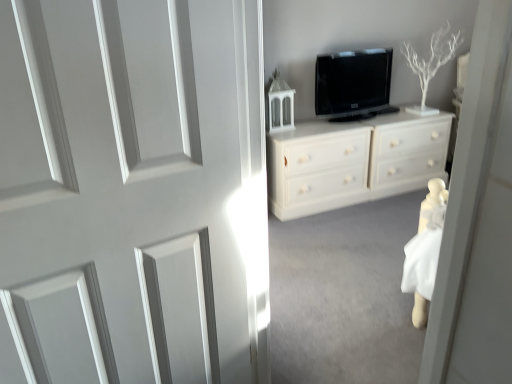
Question: Is white painted wood chest of drawers at center shorter than black glossy tv at upper center?

Choices:
 (A) no
 (B) yes

Answer: (A)

Question: Does white painted wood chest of drawers at center have a greater width compared to black glossy tv at upper center?

Choices:
 (A) yes
 (B) no

Answer: (A)

Question: Considering the relative positions of white painted wood chest of drawers at center and black glossy tv at upper center in the image provided, is white painted wood chest of drawers at center to the left of black glossy tv at upper center from the viewer's perspective?

Choices:
 (A) no
 (B) yes

Answer: (A)

Question: Is white painted wood chest of drawers at center bigger than black glossy tv at upper center?

Choices:
 (A) yes
 (B) no

Answer: (A)

Question: Would you say white painted wood chest of drawers at center is outside black glossy tv at upper center?

Choices:
 (A) yes
 (B) no

Answer: (A)

Question: Is white painted wood door at center in front of or behind black glossy tv at upper center in the image?

Choices:
 (A) behind
 (B) front

Answer: (B)

Question: From the image's perspective, is white painted wood door at center located above or below black glossy tv at upper center?

Choices:
 (A) above
 (B) below

Answer: (B)

Question: Is white painted wood door at center wider or thinner than black glossy tv at upper center?

Choices:
 (A) wide
 (B) thin

Answer: (A)

Question: Is point (41, 380) positioned closer to the camera than point (366, 97)?

Choices:
 (A) closer
 (B) farther

Answer: (A)

Question: In the image, is white painted wood chest of drawers at center positioned in front of or behind white painted wood door at center?

Choices:
 (A) behind
 (B) front

Answer: (A)

Question: Would you say white painted wood chest of drawers at center is inside or outside white painted wood door at center?

Choices:
 (A) outside
 (B) inside

Answer: (A)

Question: In terms of height, does white painted wood chest of drawers at center look taller or shorter compared to white painted wood door at center?

Choices:
 (A) short
 (B) tall

Answer: (A)

Question: Does point (440, 132) appear closer or farther from the camera than point (262, 349)?

Choices:
 (A) farther
 (B) closer

Answer: (A)

Question: From their relative heights in the image, would you say black glossy tv at upper center is taller or shorter than white painted wood door at center?

Choices:
 (A) tall
 (B) short

Answer: (B)

Question: Is black glossy tv at upper center wider or thinner than white painted wood door at center?

Choices:
 (A) wide
 (B) thin

Answer: (B)